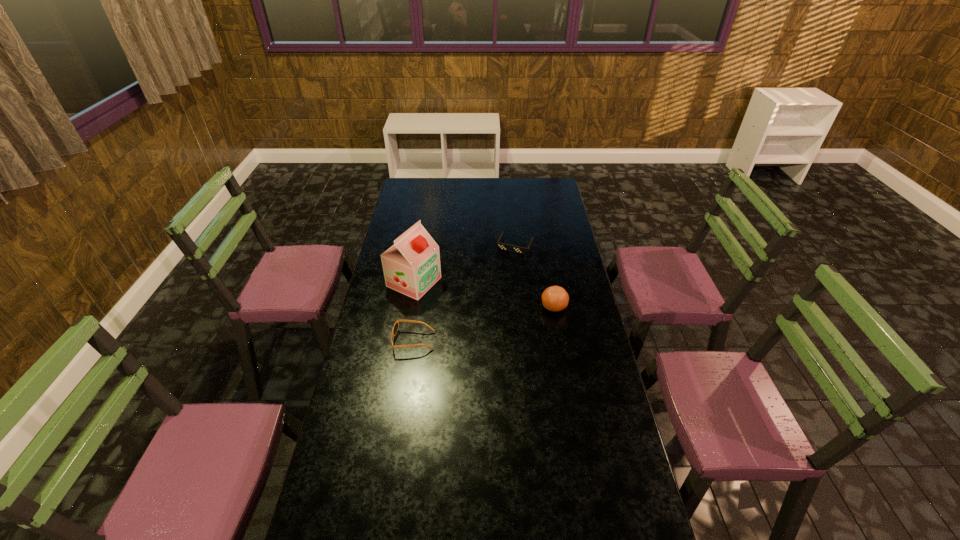
Where is `vacant spot on the desktop that is between the left sunglasses and the clementine and is positioned with the cap open on the tallest object`? This screenshot has width=960, height=540. vacant spot on the desktop that is between the left sunglasses and the clementine and is positioned with the cap open on the tallest object is located at coordinates (502, 319).

You are a GUI agent. You are given a task and a screenshot of the screen. Output one action in this format:
    pyautogui.click(x=<x>, y=<y>)
    Task: Click on the vacant space on the desktop that is between the taller sunglasses and the clementine and is positioned on the front-facing side of the right sunglasses
    
    Given the screenshot: What is the action you would take?
    pyautogui.click(x=479, y=325)